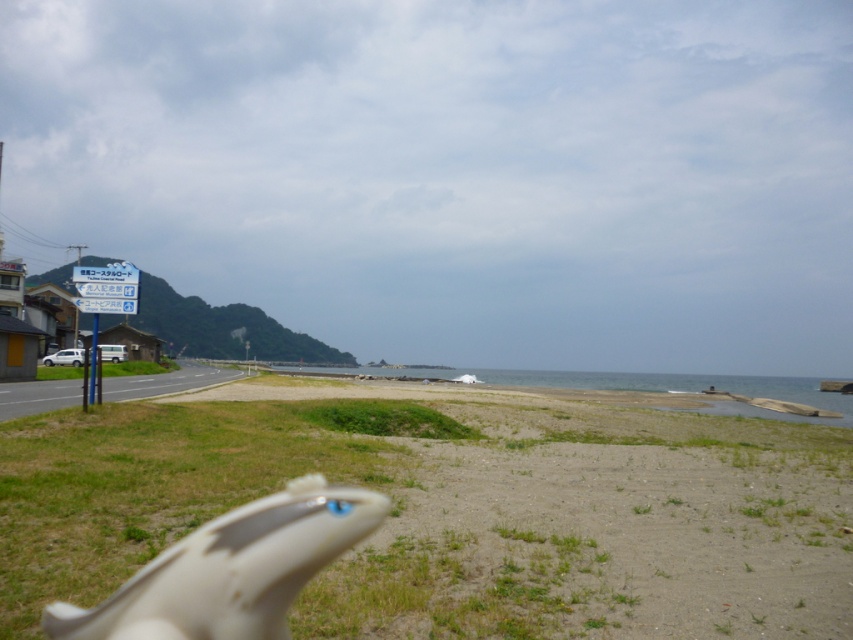
Question: Which of the following is the closest to the observer?

Choices:
 (A) green grass at left
 (B) gravelly sand beach at lower center

Answer: (B)

Question: Which point appears farthest from the camera in this image?

Choices:
 (A) (128, 284)
 (B) (113, 371)
 (C) (750, 620)

Answer: (B)

Question: Can you confirm if white plastic sign at left is positioned below blue plastic sign at upper left?

Choices:
 (A) no
 (B) yes

Answer: (B)

Question: Is white plastic sign at left further to the viewer compared to green grass at left?

Choices:
 (A) yes
 (B) no

Answer: (B)

Question: Which object is closer to the camera taking this photo?

Choices:
 (A) white plastic sign at left
 (B) green grass at left
 (C) gravelly sand beach at lower center
 (D) blue plastic sign at upper left

Answer: (C)

Question: Does gravelly sand beach at lower center appear on the right side of blue plastic sign at upper left?

Choices:
 (A) no
 (B) yes

Answer: (B)